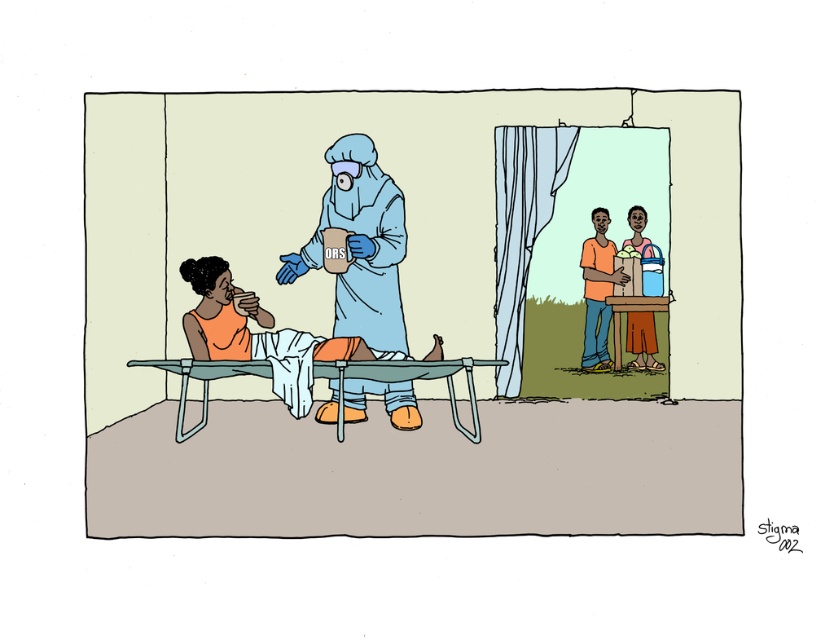
Who is positioned more to the right, orange fabric patient at center or orange cotton shirt at center?

orange cotton shirt at center is more to the right.

Which of these two, orange fabric patient at center or orange cotton shirt at center, stands taller?

orange cotton shirt at center

What do you see at coordinates (224, 314) in the screenshot? I see `orange fabric patient at center` at bounding box center [224, 314].

Image resolution: width=834 pixels, height=640 pixels. Identify the location of orange fabric patient at center. (224, 314).

Can you confirm if matte plastic cup at center is wider than orange fabric patient at center?

Incorrect, matte plastic cup at center's width does not surpass orange fabric patient at center's.

Is point (646, 182) in front of point (181, 264)?

No, (646, 182) is further to viewer.

In order to click on matte plastic cup at center in this screenshot , I will do `click(410, 310)`.

Measure the distance between matte plastic cup at center and orange cotton shirt at center.

matte plastic cup at center and orange cotton shirt at center are 5.57 meters apart.

Between matte plastic cup at center and orange cotton shirt at center, which one has more height?

orange cotton shirt at center is taller.

Does point (349, 326) come farther from viewer compared to point (604, 275)?

No, it is not.

In order to click on matte plastic cup at center in this screenshot , I will do `click(410, 310)`.